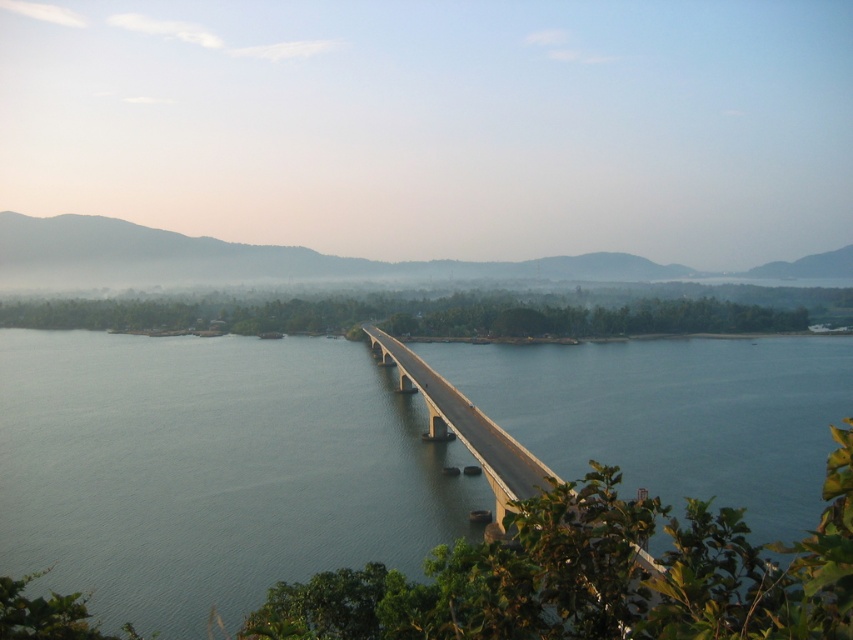
You are a drone operator planning to fly a drone over the clear blue water at center and the concrete bridge at center. Based on their heights, which object should you avoid flying too close to to prevent collision?

You should avoid flying too close to the concrete bridge at center because it is taller than the clear blue water at center, reducing the risk of collision.

You are a photographer planning to take a wide shot of the landscape. Given that the clear blue water at center and the concrete bridge at center are both in your frame, which one will occupy more of the photo?

The clear blue water at center has a larger size compared to the concrete bridge at center, so it will occupy more space in the photo.